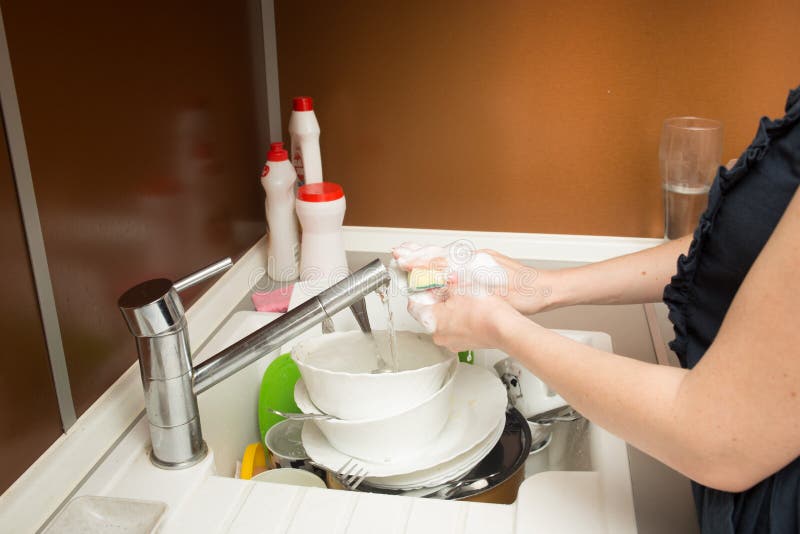
The width and height of the screenshot is (800, 534). Find the location of `brown wall panels`. brown wall panels is located at coordinates (26, 353), (161, 151), (633, 116).